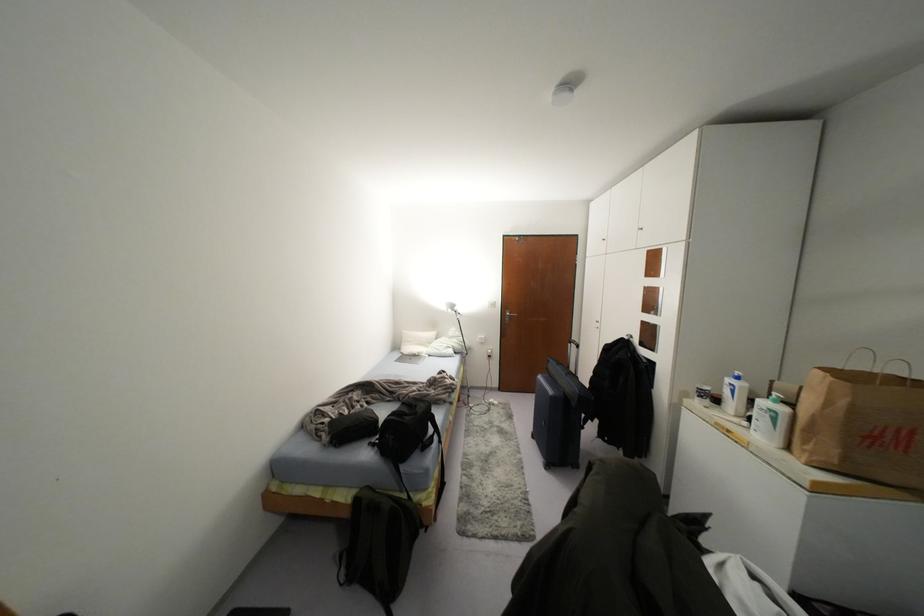
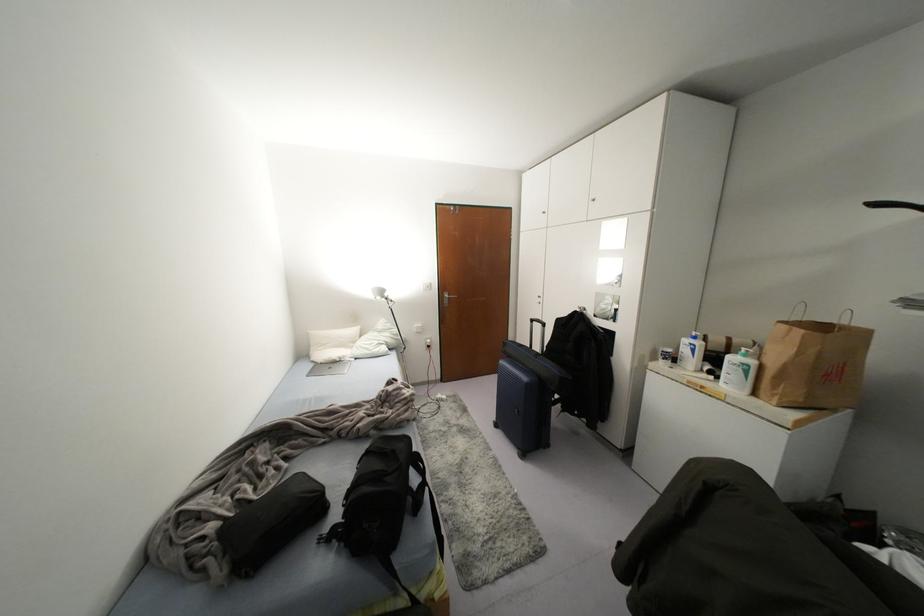
Locate, in the second image, the point that corresponds to (x=416, y=406) in the first image.

(393, 451)